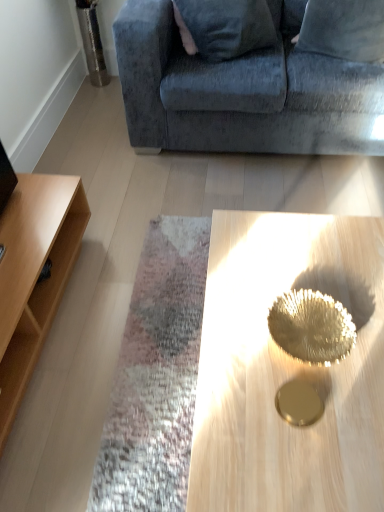
Find the location of a particular element. vacant position to the left of gold metallic tray at center is located at coordinates (129, 384).